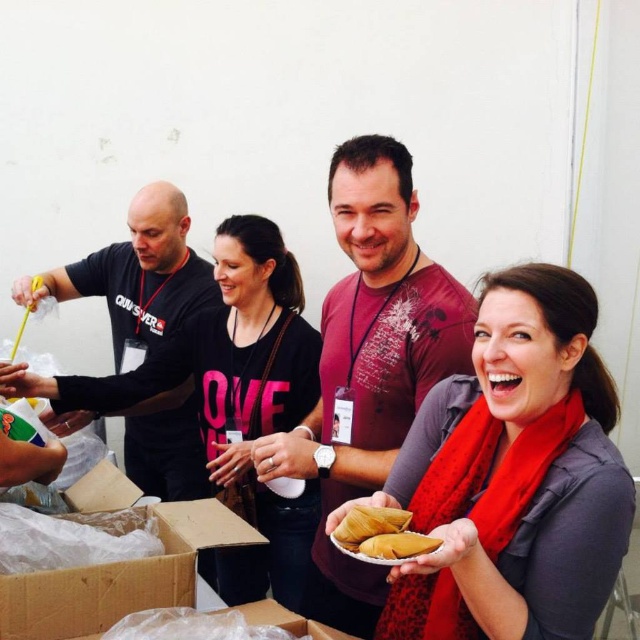
Can you confirm if maroon printed shirt at center is positioned above black matte shirt at left?

Actually, maroon printed shirt at center is below black matte shirt at left.

Between maroon printed shirt at center and black matte shirt at left, which one has less height?

With less height is black matte shirt at left.

Measure the distance between point (419, 384) and camera.

Point (419, 384) and camera are 4.91 feet apart from each other.

I want to click on maroon printed shirt at center, so (x=369, y=364).

Does golden paper-like tamales at lower center have a greater width compared to yellow matte tamales at center?

Correct, the width of golden paper-like tamales at lower center exceeds that of yellow matte tamales at center.

Is point (381, 536) positioned in front of point (380, 548)?

No, it is behind (380, 548).

The width and height of the screenshot is (640, 640). What are the coordinates of `golden paper-like tamales at lower center` in the screenshot? It's located at (380, 536).

The width and height of the screenshot is (640, 640). I want to click on gray matte scarf at center, so click(x=513, y=476).

What do you see at coordinates (513, 476) in the screenshot? I see `gray matte scarf at center` at bounding box center [513, 476].

Identify the location of gray matte scarf at center. (513, 476).